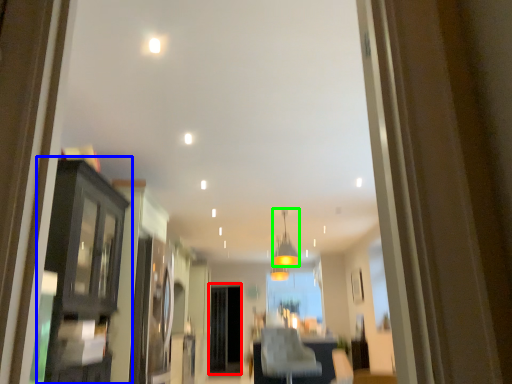
Question: Based on their relative distances, which object is nearer to screen door (highlighted by a red box)? Choose from dresser (highlighted by a blue box) and light fixture (highlighted by a green box).

Choices:
 (A) dresser
 (B) light fixture

Answer: (B)